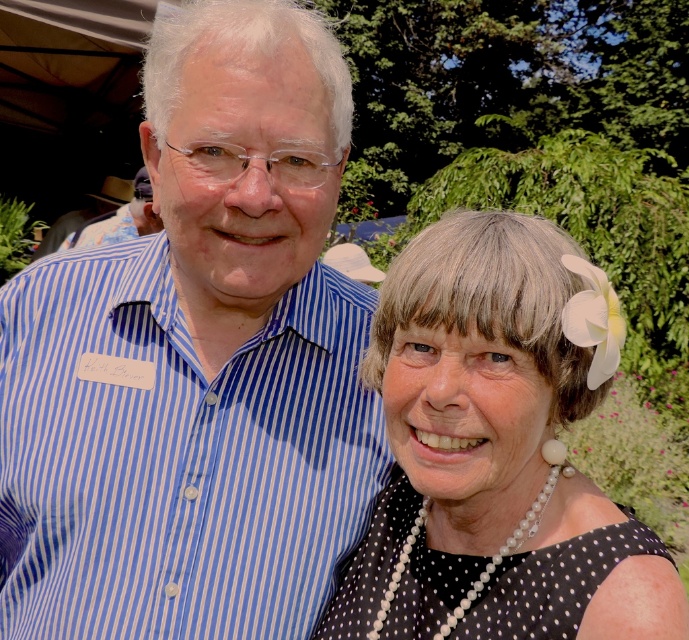
Question: Which point is farther from the camera taking this photo?

Choices:
 (A) (373, 429)
 (B) (595, 512)

Answer: (A)

Question: Which point is closer to the camera?

Choices:
 (A) blue striped shirt at left
 (B) black dotted dress at center

Answer: (B)

Question: Considering the relative positions of blue striped shirt at left and black dotted dress at center in the image provided, where is blue striped shirt at left located with respect to black dotted dress at center?

Choices:
 (A) above
 (B) below

Answer: (A)

Question: Does blue striped shirt at left appear under black dotted dress at center?

Choices:
 (A) no
 (B) yes

Answer: (A)

Question: Does blue striped shirt at left have a larger size compared to black dotted dress at center?

Choices:
 (A) yes
 (B) no

Answer: (A)

Question: Which object appears farthest from the camera in this image?

Choices:
 (A) blue striped shirt at left
 (B) black dotted dress at center

Answer: (A)